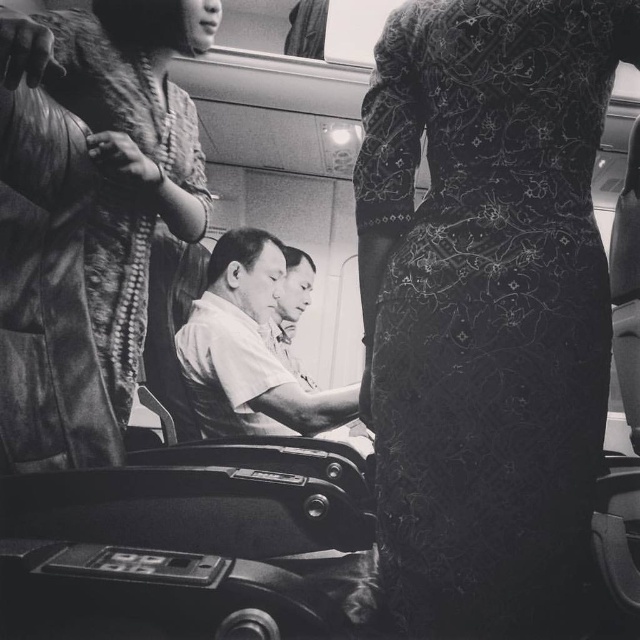
Does smooth white shirt at center appear on the left side of smooth skin man at center?

Yes, smooth white shirt at center is to the left of smooth skin man at center.

What do you see at coordinates (248, 349) in the screenshot? The width and height of the screenshot is (640, 640). I see `smooth white shirt at center` at bounding box center [248, 349].

You are a GUI agent. You are given a task and a screenshot of the screen. Output one action in this format:
    pyautogui.click(x=<x>, y=<y>)
    Task: Click on the smooth white shirt at center
    The height and width of the screenshot is (640, 640).
    Given the screenshot: What is the action you would take?
    pyautogui.click(x=248, y=349)

In the scene shown: Can you confirm if black lace dress at center is shorter than smooth white shirt at center?

No, black lace dress at center is not shorter than smooth white shirt at center.

Does black lace dress at center appear over smooth white shirt at center?

Yes.

Does point (554, 372) come behind point (260, 339)?

No, it is in front of (260, 339).

Locate an element on the screen. The image size is (640, 640). black lace dress at center is located at coordinates (486, 301).

Can you confirm if fur coat at upper left is positioned below smooth skin man at center?

Actually, fur coat at upper left is above smooth skin man at center.

From the picture: Does fur coat at upper left have a smaller size compared to smooth skin man at center?

No.

Identify the location of fur coat at upper left. (88, 214).

The height and width of the screenshot is (640, 640). I want to click on fur coat at upper left, so click(x=88, y=214).